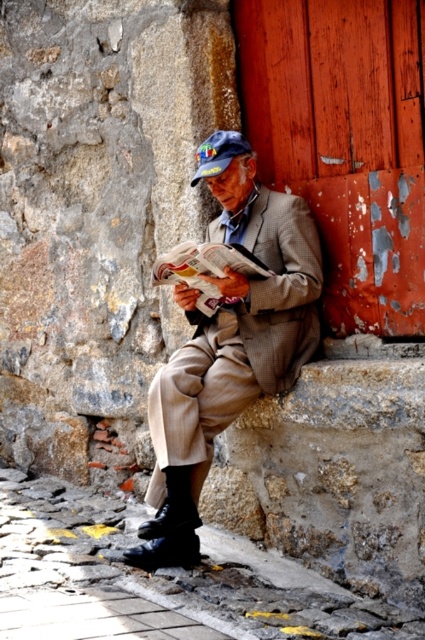
Is point (339, 320) closer to viewer compared to point (226, 406)?

No, (339, 320) is further to viewer.

This screenshot has height=640, width=425. What do you see at coordinates (345, 141) in the screenshot?
I see `peeling paint door at right` at bounding box center [345, 141].

Describe the element at coordinates (345, 141) in the screenshot. The height and width of the screenshot is (640, 425). I see `peeling paint door at right` at that location.

At what (x,y) coordinates should I click in order to perform the action: click on peeling paint door at right. Please return your answer as a coordinate pair (x, y). This screenshot has height=640, width=425. Looking at the image, I should click on (345, 141).